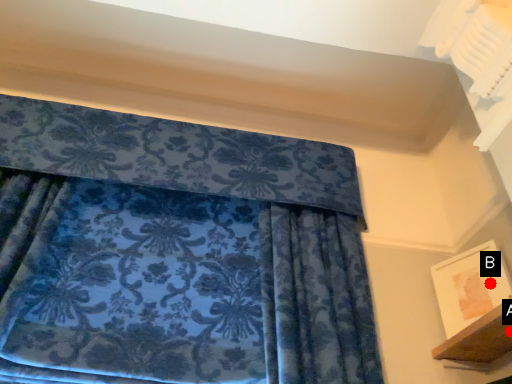
Question: Two points are circled on the image, labeled by A and B beside each circle. Which point appears closest to the camera in this image?

Choices:
 (A) A is closer
 (B) B is closer

Answer: (A)